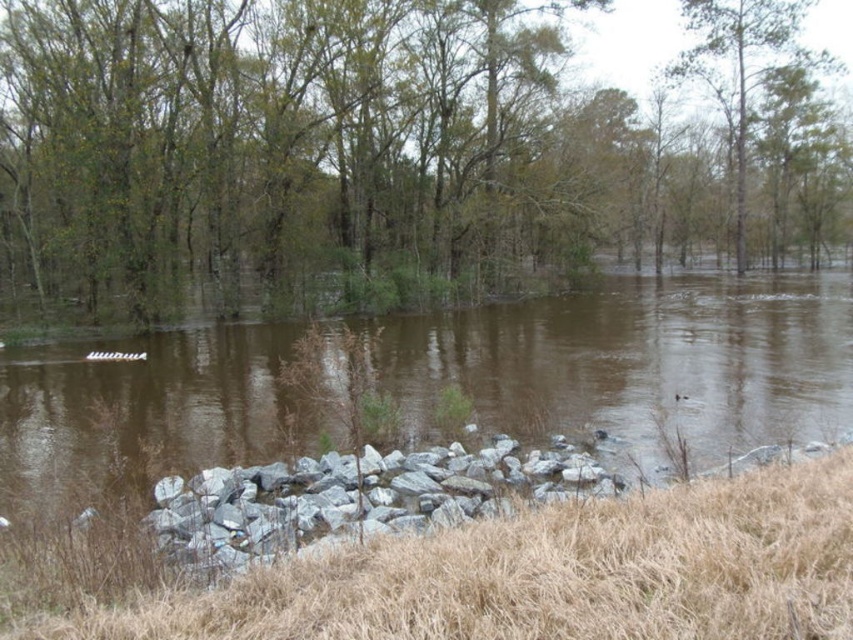
You are a bird flying over the flooded area and want to land on the nearest tree. Which tree would you choose between the brown leafy tree at center and the green leafy tree at upper center?

The brown leafy tree at center is below the green leafy tree at upper center, so the brown leafy tree at center is closer to the ground and therefore the nearest tree for landing.

You are standing at the edge of the flooded area and see the point marked as point (392, 150). What is the closest object to this point?

The closest object to point (392, 150) is the brown leafy tree at center, which is represented by that point.

You are standing in a flooded area and see a brown leafy tree at center and a green leafy tree at upper center. Which tree is more to the left?

The brown leafy tree at center is more to the left because it is positioned on the left side of the green leafy tree at upper center.